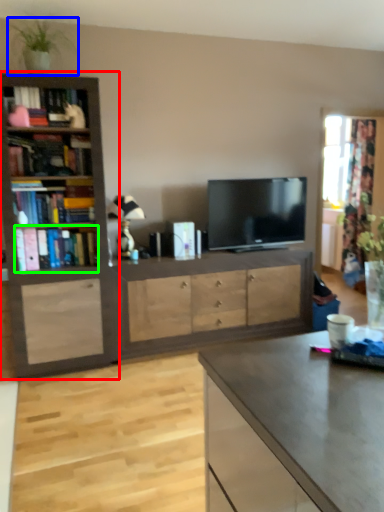
Question: Which object is positioned closest to bookcase (highlighted by a red box)? Select from houseplant (highlighted by a blue box) and book (highlighted by a green box).

Choices:
 (A) houseplant
 (B) book

Answer: (B)